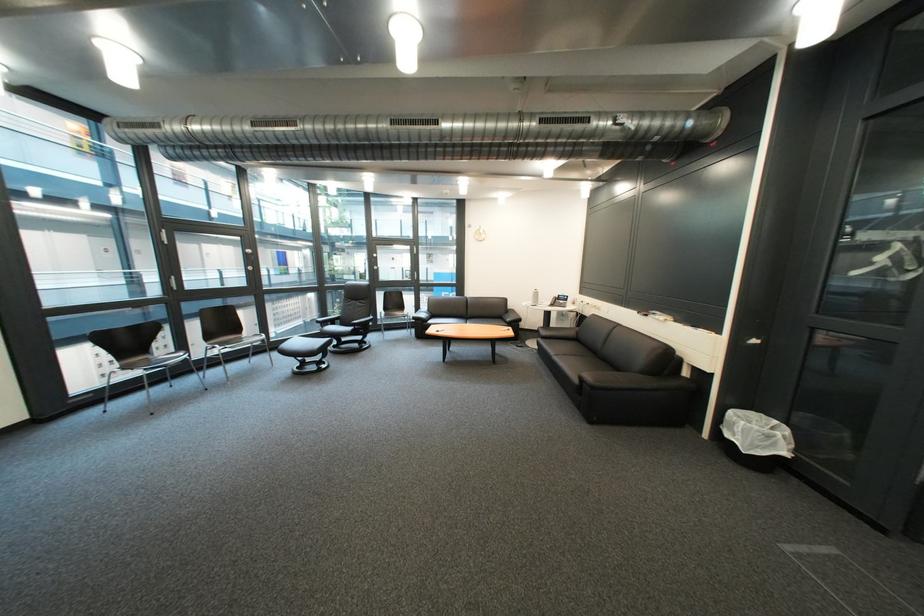
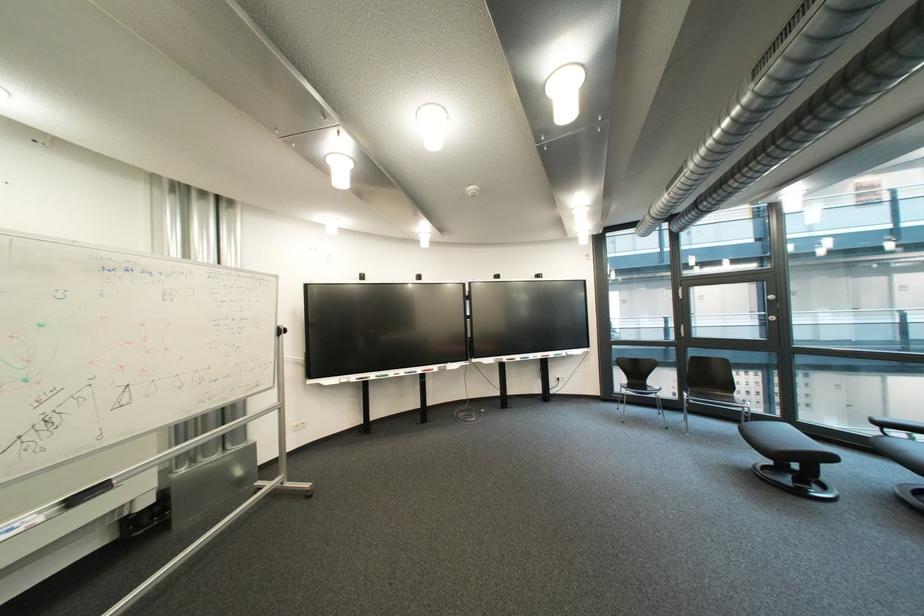
Where in the second image is the point corresponding to point (229, 347) from the first image?

(699, 395)